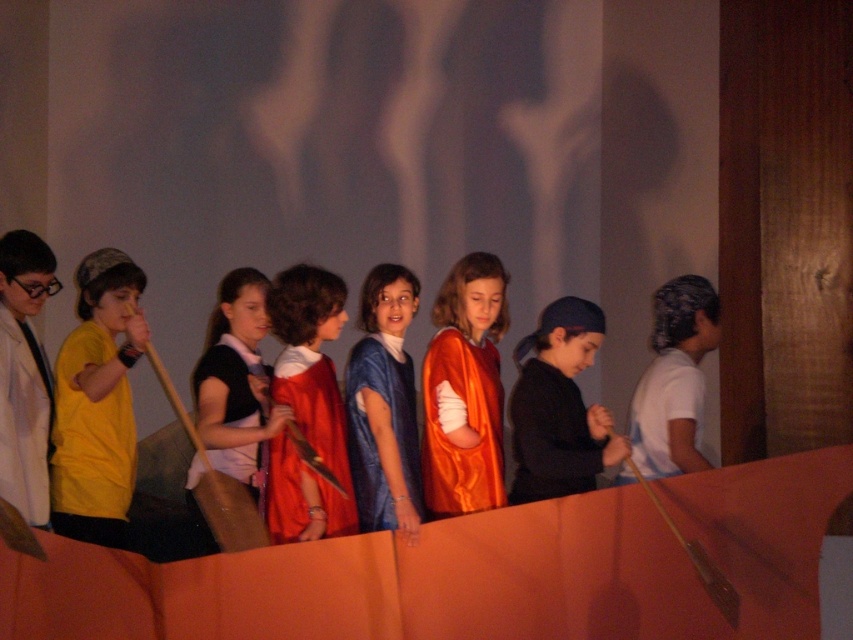
Question: Among these points, which one is farthest from the camera?

Choices:
 (A) (670, 428)
 (B) (485, 292)

Answer: (B)

Question: Is the position of satin orange robe at center less distant than that of black matte shirt at center?

Choices:
 (A) yes
 (B) no

Answer: (B)

Question: Estimate the real-world distances between objects in this image. Which object is farther from the blue satin dress at center?

Choices:
 (A) black matte shirt at center
 (B) satin orange robe at center
 (C) shiny red cape at center

Answer: (A)

Question: Which object appears closest to the camera in this image?

Choices:
 (A) matte orange cape at center
 (B) black matte shirt at center
 (C) shiny red cape at center

Answer: (A)

Question: Does black matte shirt at center appear over white cotton shirt at right?

Choices:
 (A) yes
 (B) no

Answer: (B)

Question: Can you confirm if satin orange robe at center is positioned to the left of black matte shirt at center?

Choices:
 (A) yes
 (B) no

Answer: (A)